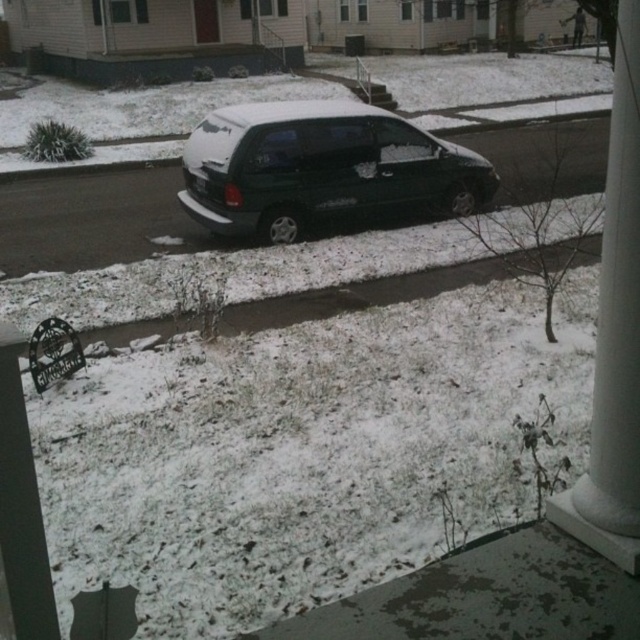
Question: Can you confirm if shiny dark green minivan at center is wider than white smooth column at right?

Choices:
 (A) yes
 (B) no

Answer: (A)

Question: In this image, where is shiny dark green minivan at center located relative to white smooth column at right?

Choices:
 (A) above
 (B) below

Answer: (A)

Question: Is shiny dark green minivan at center wider than white smooth column at right?

Choices:
 (A) no
 (B) yes

Answer: (B)